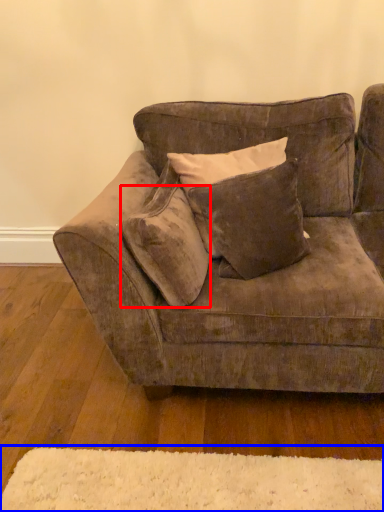
Question: Which object appears farthest to the camera in this image, pillow (highlighted by a red box) or mat (highlighted by a blue box)?

Choices:
 (A) pillow
 (B) mat

Answer: (A)